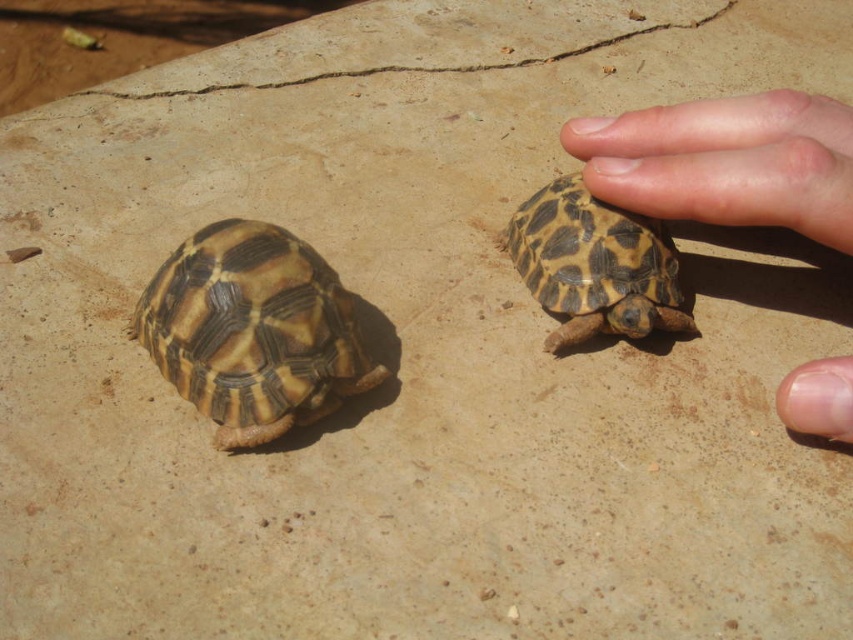
Question: From the image, what is the correct spatial relationship of smooth skin hand at right in relation to patterned shell tortoise at center?

Choices:
 (A) above
 (B) below

Answer: (A)

Question: Which of these objects is positioned closest to the patterned shell tortoise at center?

Choices:
 (A) brown textured tortoise at left
 (B) smooth skin hand at right

Answer: (B)

Question: Does brown textured tortoise at left appear on the right side of patterned shell tortoise at center?

Choices:
 (A) no
 (B) yes

Answer: (A)

Question: Among these objects, which one is farthest from the camera?

Choices:
 (A) pale skin at upper right
 (B) brown textured tortoise at left
 (C) smooth skin hand at right
 (D) patterned shell tortoise at center

Answer: (D)

Question: Can you confirm if brown textured tortoise at left is wider than pale skin at upper right?

Choices:
 (A) yes
 (B) no

Answer: (A)

Question: Which of the following is the closest to the observer?

Choices:
 (A) brown textured tortoise at left
 (B) pale skin at upper right
 (C) smooth skin hand at right
 (D) patterned shell tortoise at center

Answer: (C)